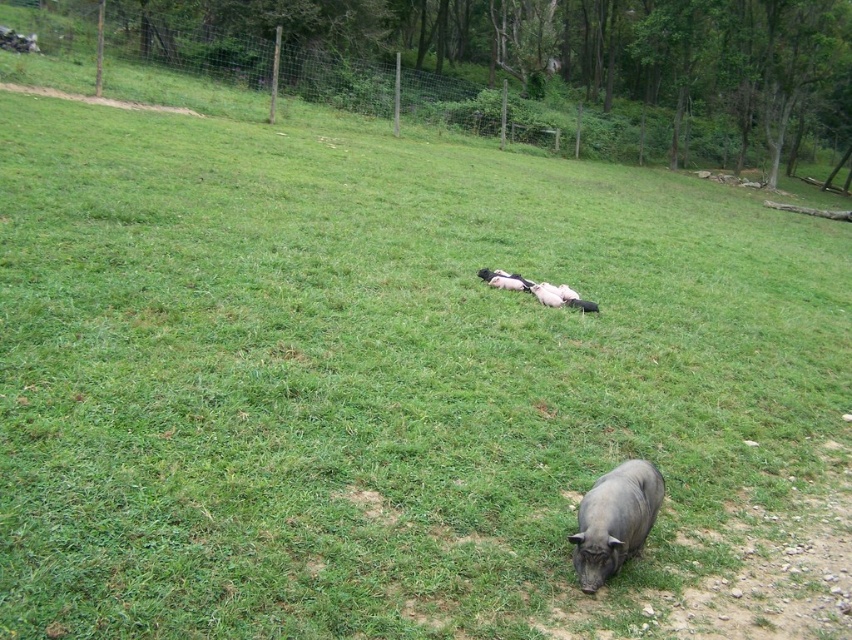
Question: Among these points, which one is farthest from the camera?

Choices:
 (A) (496, 282)
 (B) (582, 528)

Answer: (A)

Question: Which point is farther to the camera?

Choices:
 (A) (x=661, y=492)
 (B) (x=528, y=282)

Answer: (B)

Question: Is gray matte pig at lower center below pink soft piglets at center?

Choices:
 (A) no
 (B) yes

Answer: (B)

Question: Observing the image, what is the correct spatial positioning of gray matte pig at lower center in reference to pink soft piglets at center?

Choices:
 (A) above
 (B) below

Answer: (B)

Question: Can you confirm if gray matte pig at lower center is wider than pink soft piglets at center?

Choices:
 (A) yes
 (B) no

Answer: (B)